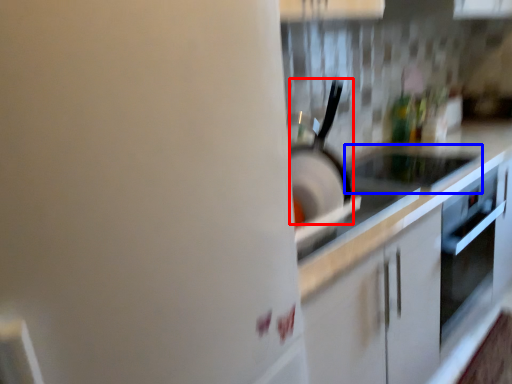
Question: Which point is further to the camera, kitchen appliance (highlighted by a red box) or appliance (highlighted by a blue box)?

Choices:
 (A) kitchen appliance
 (B) appliance

Answer: (B)